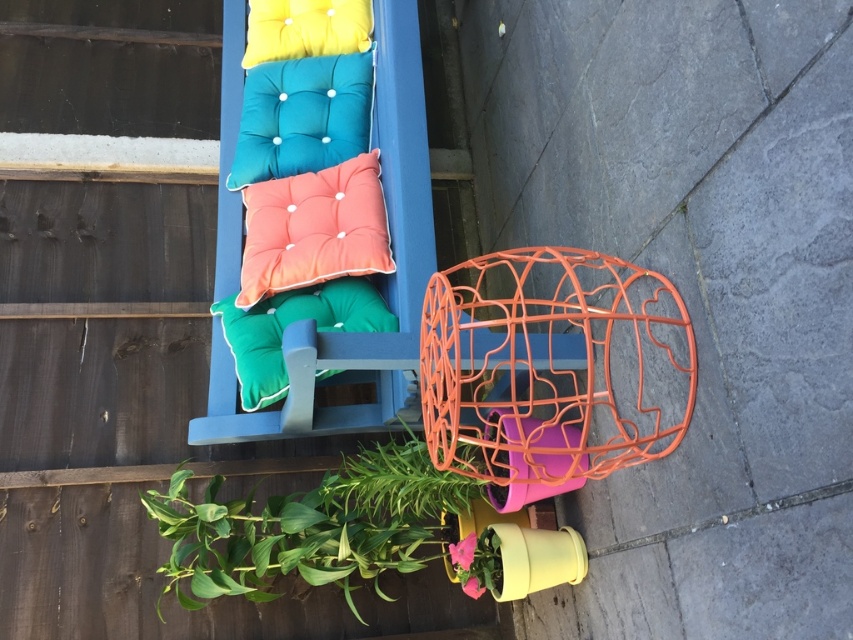
You are arranging flowers in the garden and need to move the green leafy plant at lower left. To access the plant, do you need to move the coral fabric cushion at center first?

The green leafy plant at lower left is in front of the coral fabric cushion at center, so you do not need to move the coral fabric cushion at center first to access the plant.

You are sitting on the bench and want to grab the green leafy plant at lower left to water it. Which direction should you reach towards relative to the green fabric pillow at center?

The green leafy plant at lower left is positioned on the right side of the green fabric pillow at center, so you should reach to the right of the green fabric pillow at center to grab it.

You are sitting on the blue bench and want to grab the green leafy plant at lower left and the green fabric pillow at center. Which one can you reach without moving from your current position?

The green leafy plant at lower left is closer to the viewer than the green fabric pillow at center, so you can reach the green leafy plant at lower left without moving, but you might need to adjust your position to reach the green fabric pillow at center.